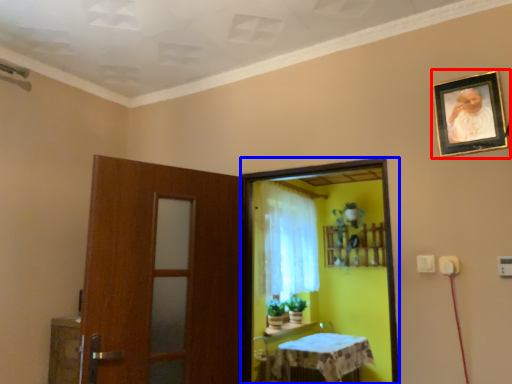
Question: Which point is closer to the camera, picture frame (highlighted by a red box) or screen door (highlighted by a blue box)?

Choices:
 (A) picture frame
 (B) screen door

Answer: (A)